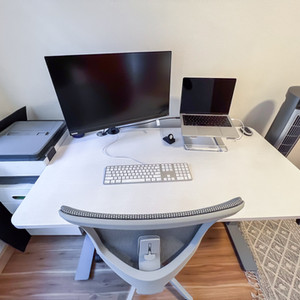
What are the coordinates of `chair` in the screenshot? It's located at (153, 282).